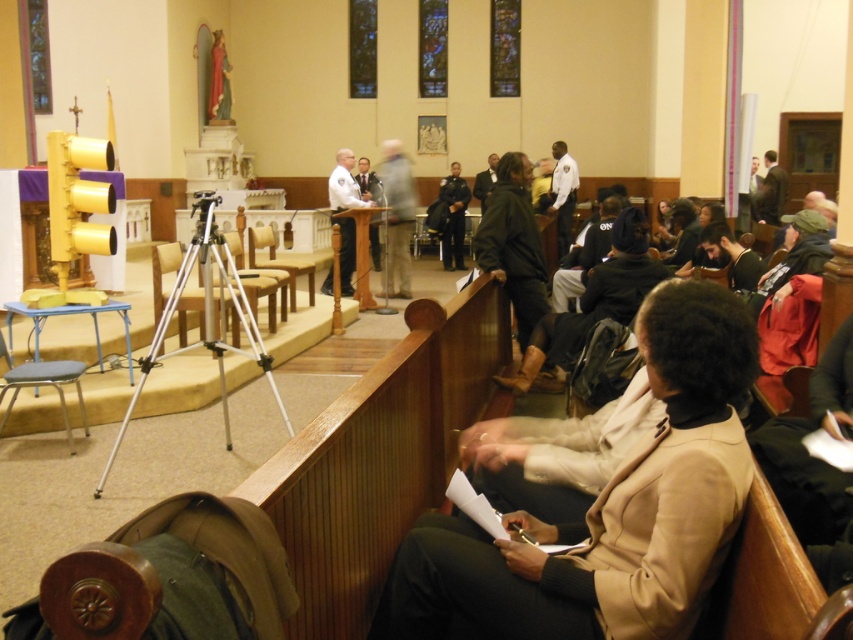
Question: In this image, where is metallic tripod at center located relative to wooden chair at center?

Choices:
 (A) above
 (B) below

Answer: (B)

Question: Does gray fabric chair at lower left appear under wooden chair at center?

Choices:
 (A) no
 (B) yes

Answer: (B)

Question: Which object appears closest to the camera in this image?

Choices:
 (A) white uniform at center
 (B) beige wool coat at center
 (C) dark brown leather jacket at center
 (D) gray fabric chair at lower left

Answer: (B)

Question: Based on their relative distances, which object is farther from the matte black suit at center?

Choices:
 (A) white uniform at center
 (B) dark brown leather jacket at center
 (C) wooden chair at center
 (D) gray fabric chair at lower left

Answer: (D)

Question: Which point appears farthest from the camera in this image?

Choices:
 (A) (734, 444)
 (B) (253, 305)

Answer: (B)

Question: Is beige wool coat at center to the left of dark brown leather jacket at center from the viewer's perspective?

Choices:
 (A) yes
 (B) no

Answer: (A)